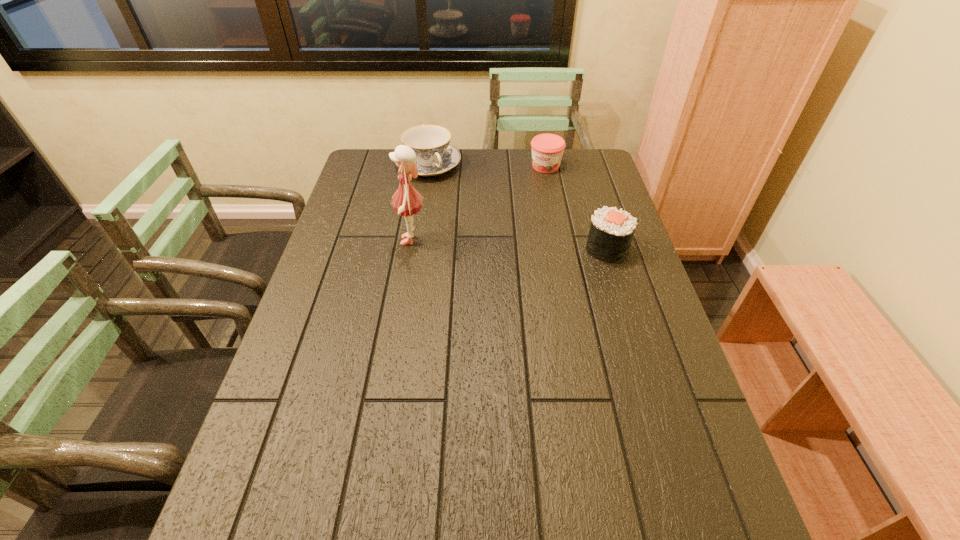
Image resolution: width=960 pixels, height=540 pixels. In order to click on free space between the doll and the shortest object in this screenshot , I will do `click(479, 204)`.

Identify the location of free area in between the chinaware and the sushi. (517, 207).

I want to click on free space between the third object from left to right and the tallest object, so click(479, 204).

The height and width of the screenshot is (540, 960). What are the coordinates of `unoccupied area between the tallest object and the rightmost object` in the screenshot? It's located at pyautogui.click(x=510, y=245).

Find the location of a particular element. unoccupied area between the doll and the rightmost object is located at coordinates (510, 245).

The image size is (960, 540). What are the coordinates of `vacant area between the shortest object and the chinaware` in the screenshot? It's located at (487, 166).

This screenshot has height=540, width=960. In order to click on blank region between the tallest object and the jam in this screenshot , I will do `click(479, 204)`.

Identify the location of object that is the second closest one to the chinaware. pos(547,149).

At what (x,y) coordinates should I click in order to perform the action: click on the closest object to the sushi. Please return your answer as a coordinate pair (x, y). Looking at the image, I should click on (547, 149).

At what (x,y) coordinates should I click in order to perform the action: click on vacant region that satisfies the following two spatial constraints: 1. on the front side of the chinaware; 2. on the left side of the shortest object. Please return your answer as a coordinate pair (x, y). Looking at the image, I should click on (428, 166).